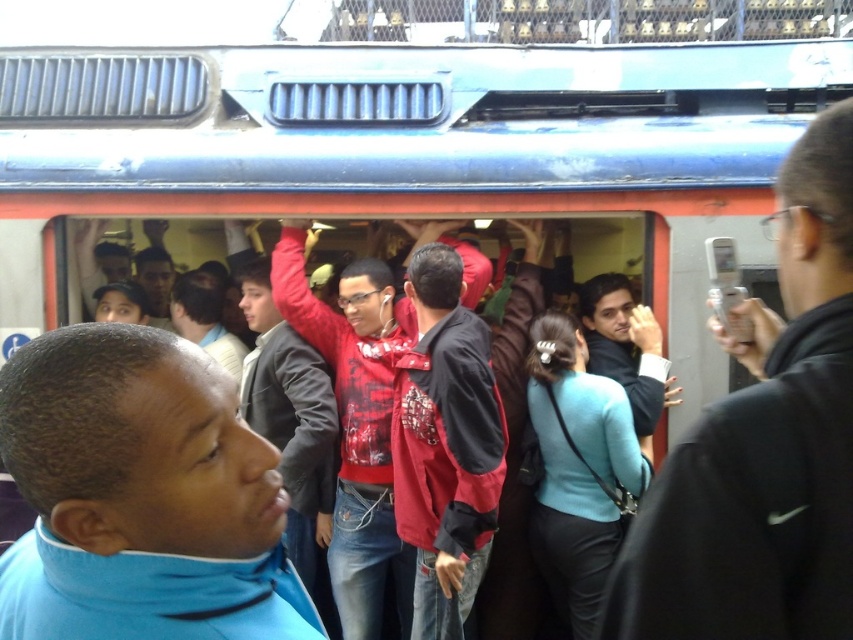
You are a passenger on a crowded train and want to move from the left side to the right side of the train car. There are two people blocking your path, wearing a black leather jacket at right and a teal matte sweater at center. Which person should you go around to reach the right side more efficiently?

To reach the right side more efficiently, you should go around the black leather jacket at right since it is positioned on the right side of the teal matte sweater at center, making it closer to your destination.

You are standing in the train car and want to place a small backpack on the floor near the blue fabric jacket at lower left. What are the coordinates where you should place it?

The coordinates to place the backpack near the blue fabric jacket at lower left would be approximately around the point mentioned in the description, which is at 0.777 on the x axis and 0.165 on the y axis.

Based on the photo, you are standing on the train platform and see the train coming. You need to locate the red plaid shirt at center. Where is it located in the train car?

The red plaid shirt at center is located at point (445, 445) in the train car.